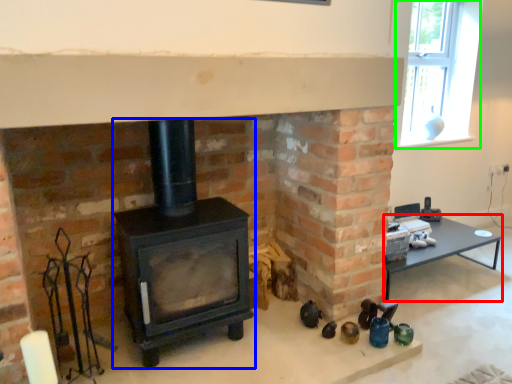
Question: Which is farther away from table (highlighted by a red box)? wood burning stove (highlighted by a blue box) or window (highlighted by a green box)?

Choices:
 (A) wood burning stove
 (B) window

Answer: (A)